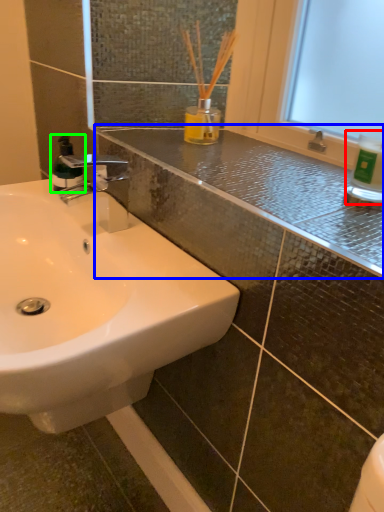
Question: Based on their relative distances, which object is farther from bottle (highlighted by a red box)? Choose from counter top (highlighted by a blue box) and mouthwash (highlighted by a green box).

Choices:
 (A) counter top
 (B) mouthwash

Answer: (B)